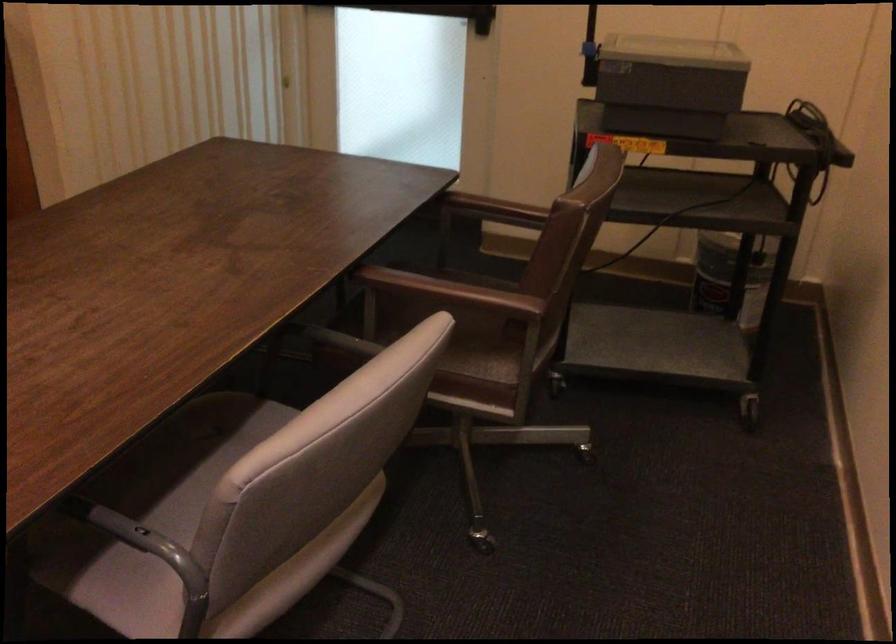
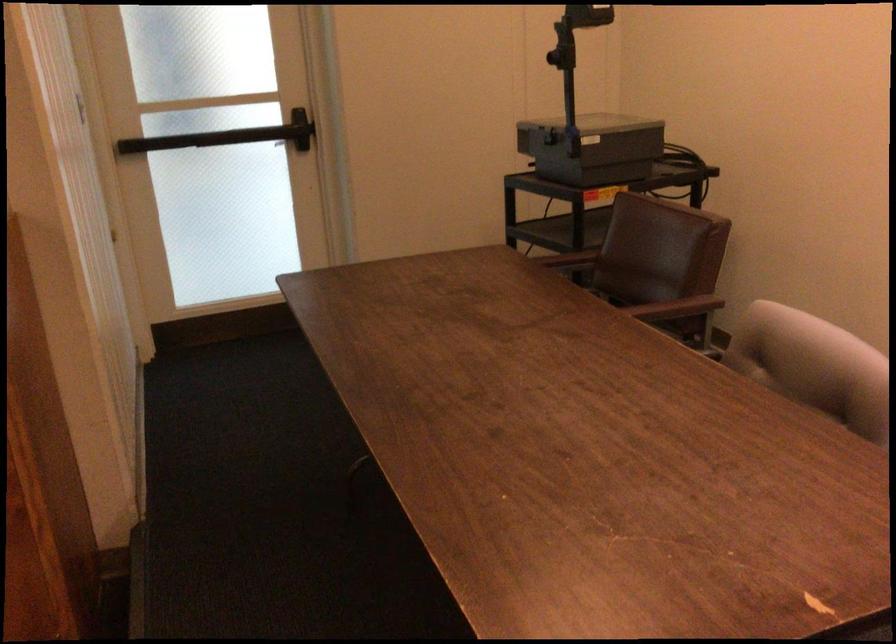
Locate, in the second image, the point that corresponds to pixel 470 310 in the first image.

(677, 308)